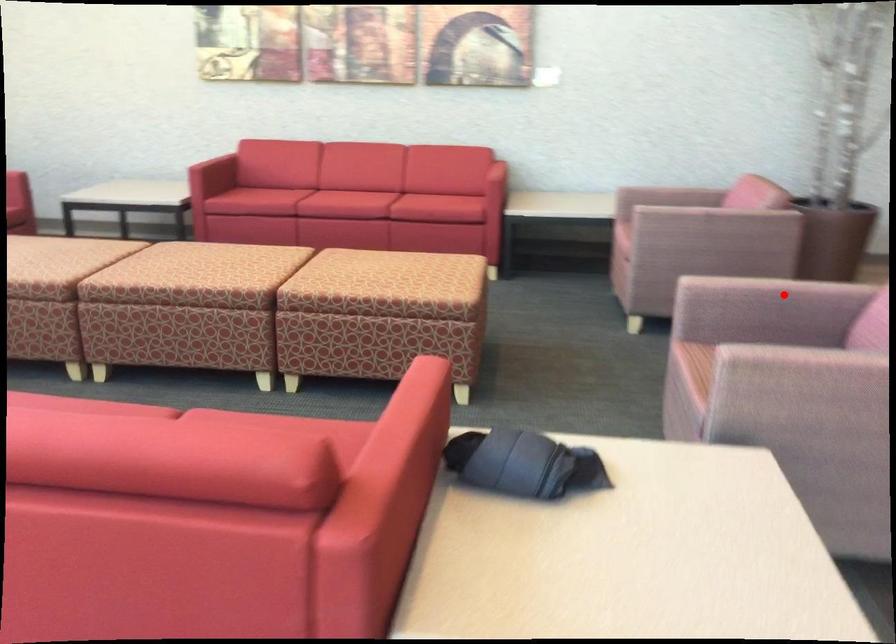
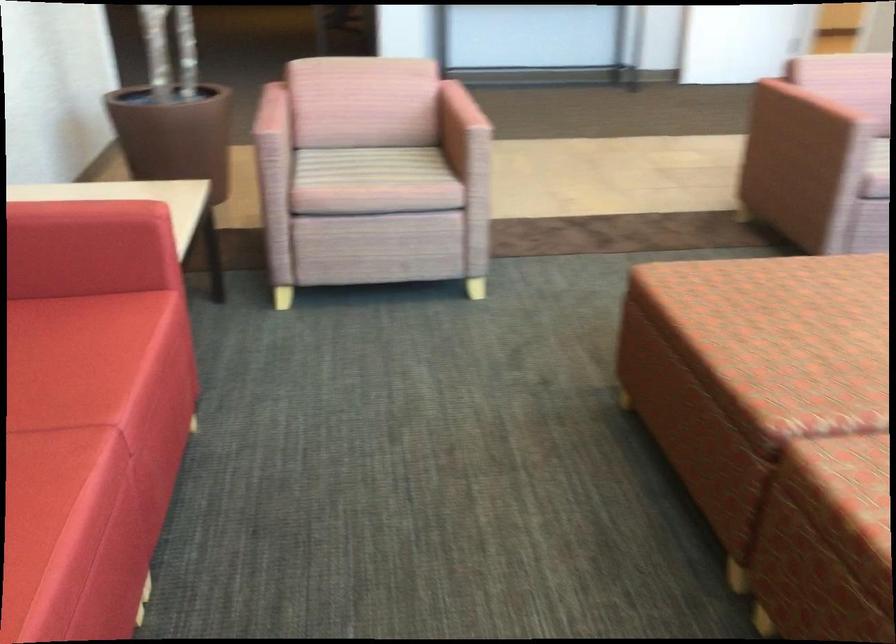
Question: A red point is marked in image1. In image2, is the corresponding 3D point closer to the camera or farther? Reply with the corresponding letter.

Choices:
 (A) The corresponding 3D point is closer.
 (B) The corresponding 3D point is farther.

Answer: (B)